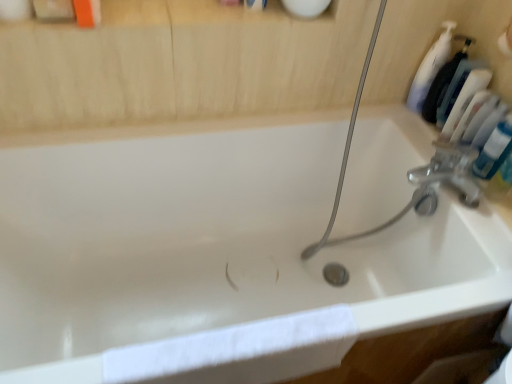
The image size is (512, 384). I want to click on white plastic bottle at upper right, so click(x=430, y=67).

Describe the element at coordinates (211, 241) in the screenshot. This screenshot has height=384, width=512. I see `white glossy bathtub at center` at that location.

Locate an element on the screen. This screenshot has width=512, height=384. white plastic bottle at upper right is located at coordinates (430, 67).

In the scene shown: Measure the distance from white plastic bottle at upper right to white cotton towel at lower left.

white plastic bottle at upper right is 35.01 inches from white cotton towel at lower left.

Do you think white plastic bottle at upper right is within white cotton towel at lower left, or outside of it?

white plastic bottle at upper right is located beyond the bounds of white cotton towel at lower left.

From a real-world perspective, does white plastic bottle at upper right sit lower than white cotton towel at lower left?

No, from a real-world perspective, white plastic bottle at upper right is not below white cotton towel at lower left.

Is blue glossy tube at upper right not close to white cotton towel at lower left?

No, there isn't a large distance between blue glossy tube at upper right and white cotton towel at lower left.

From a real-world perspective, which object stands above the other?

From a 3D spatial view, blue glossy tube at upper right is above.

Is blue glossy tube at upper right wider or thinner than white cotton towel at lower left?

blue glossy tube at upper right is thinner than white cotton towel at lower left.

From the image's perspective, is white glossy bathtub at center located above or below blue glossy tube at upper right?

Based on their image positions, white glossy bathtub at center is located beneath blue glossy tube at upper right.

Which object is closer to the camera, white glossy bathtub at center or blue glossy tube at upper right?

Positioned in front is white glossy bathtub at center.

Considering the sizes of objects white glossy bathtub at center and blue glossy tube at upper right in the image provided, who is thinner, white glossy bathtub at center or blue glossy tube at upper right?

blue glossy tube at upper right is thinner.

Can you confirm if white glossy bathtub at center is smaller than blue glossy tube at upper right?

Actually, white glossy bathtub at center might be larger than blue glossy tube at upper right.

Measure the distance between white cotton towel at lower left and blue glossy tube at upper right.

A distance of 30.11 inches exists between white cotton towel at lower left and blue glossy tube at upper right.

Considering the relative positions of white cotton towel at lower left and blue glossy tube at upper right in the image provided, is white cotton towel at lower left to the left of blue glossy tube at upper right from the viewer's perspective?

Indeed, white cotton towel at lower left is positioned on the left side of blue glossy tube at upper right.

In the image, there is a blue glossy tube at upper right. Identify the location of bath towel below it (from the image's perspective). (240, 351).

Considering the sizes of objects white plastic bottle at upper right and blue glossy tube at upper right in the image provided, who is shorter, white plastic bottle at upper right or blue glossy tube at upper right?

blue glossy tube at upper right.

Who is more distant, white plastic bottle at upper right or blue glossy tube at upper right?

white plastic bottle at upper right is behind.

From a real-world perspective, is white plastic bottle at upper right positioned above or below blue glossy tube at upper right?

From a real-world perspective, white plastic bottle at upper right is physically above blue glossy tube at upper right.

Is point (503, 141) positioned in front of point (255, 268)?

Yes.

Is blue glossy tube at upper right closer to the viewer compared to white glossy bathtub at center?

No, blue glossy tube at upper right is further to the viewer.

Is blue glossy tube at upper right taller than white glossy bathtub at center?

No, blue glossy tube at upper right is not taller than white glossy bathtub at center.

Based on the photo, from the image's perspective, between blue glossy tube at upper right and white glossy bathtub at center, which one is located above?

From the image's view, blue glossy tube at upper right is above.

Is the depth of blue glossy tube at upper right less than that of white plastic bottle at upper right?

Yes, blue glossy tube at upper right is closer to the viewer.

From a real-world perspective, is blue glossy tube at upper right located higher than white plastic bottle at upper right?

Incorrect, from a real-world perspective, blue glossy tube at upper right is lower than white plastic bottle at upper right.

How different are the orientations of blue glossy tube at upper right and white plastic bottle at upper right in degrees?

0.00598 degrees separate the facing orientations of blue glossy tube at upper right and white plastic bottle at upper right.

Can you see blue glossy tube at upper right touching white plastic bottle at upper right?

blue glossy tube at upper right and white plastic bottle at upper right are clearly separated.

The height and width of the screenshot is (384, 512). Find the location of `cleaning product on the right of white cotton towel at lower left`. cleaning product on the right of white cotton towel at lower left is located at coordinates (430, 67).

At what (x,y) coordinates should I click in order to perform the action: click on mouthwash behind the white cotton towel at lower left. Please return your answer as a coordinate pair (x, y). Image resolution: width=512 pixels, height=384 pixels. Looking at the image, I should click on (494, 150).

Estimate the real-world distances between objects in this image. Which object is further from blue glossy tube at upper right, white cotton towel at lower left or white glossy bathtub at center?

white cotton towel at lower left lies further to blue glossy tube at upper right than the other object.

Estimate the real-world distances between objects in this image. Which object is closer to blue glossy tube at upper right, white cotton towel at lower left or white plastic bottle at upper right?

white plastic bottle at upper right.

Based on their spatial positions, is white plastic bottle at upper right or blue glossy tube at upper right further from white cotton towel at lower left?

white plastic bottle at upper right lies further to white cotton towel at lower left than the other object.

Considering their positions, is white glossy bathtub at center positioned further to blue glossy tube at upper right than white cotton towel at lower left?

white cotton towel at lower left is positioned further to the anchor blue glossy tube at upper right.

Considering their positions, is blue glossy tube at upper right positioned closer to white cotton towel at lower left than white glossy bathtub at center?

white glossy bathtub at center.

Considering their positions, is white glossy bathtub at center positioned closer to white cotton towel at lower left than white plastic bottle at upper right?

Among the two, white glossy bathtub at center is located nearer to white cotton towel at lower left.

When comparing their distances from white glossy bathtub at center, does blue glossy tube at upper right or white cotton towel at lower left seem closer?

white cotton towel at lower left lies closer to white glossy bathtub at center than the other object.

From the image, which object appears to be farther from white cotton towel at lower left, white plastic bottle at upper right or white glossy bathtub at center?

white plastic bottle at upper right.

The height and width of the screenshot is (384, 512). What are the coordinates of `bath towel between white glossy bathtub at center and blue glossy tube at upper right from left to right` in the screenshot? It's located at (240, 351).

The width and height of the screenshot is (512, 384). What are the coordinates of `cleaning product located between white cotton towel at lower left and blue glossy tube at upper right in the left-right direction` in the screenshot? It's located at (430, 67).

At what (x,y) coordinates should I click in order to perform the action: click on cleaning product between white glossy bathtub at center and blue glossy tube at upper right from left to right. Please return your answer as a coordinate pair (x, y). This screenshot has width=512, height=384. Looking at the image, I should click on (430, 67).

This screenshot has height=384, width=512. In order to click on bathtub between white plastic bottle at upper right and white cotton towel at lower left in the vertical direction in this screenshot , I will do pos(211,241).